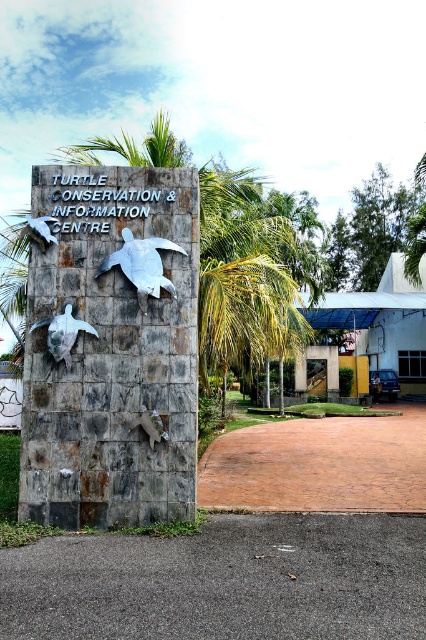
You are standing at the entrance of the Turtle Conservation Centre and see the rusty stone turtles at center and the metallic turtle at center. Which turtle is more to the left?

The rusty stone turtles at center is positioned on the left side of metallic turtle at center, so it is more to the left.

You are a visitor at the Turtle Conservation Centre and want to take a photo of both the rusty stone turtles at center and the matte silver turtle at lower left. Which turtle should you focus on first if you want to capture both in a single frame without moving your camera?

The rusty stone turtles at center is taller than the matte silver turtle at lower left, so you should focus on the matte silver turtle at lower left first to ensure both fit in the frame.

You are standing in front of the Turtle Conservation Centre and want to take a photo of the rusty stone turtles at center. If your camera has a minimum focusing distance of 5 meters, will you be able to take a clear photo without moving closer?

The rusty stone turtles at center are 6.13 meters away from you, which is beyond the camera minimum focusing distance of 5 meters. Therefore, you can take a clear photo without moving closer.